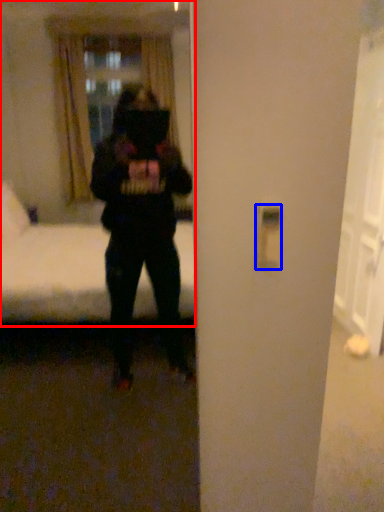
Question: Which object appears farthest to the camera in this image, mirror (highlighted by a red box) or light switch (highlighted by a blue box)?

Choices:
 (A) mirror
 (B) light switch

Answer: (B)